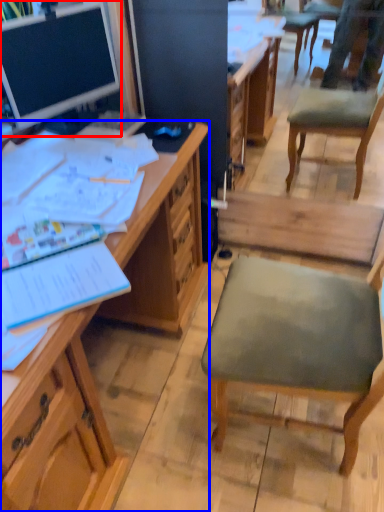
Question: Which of the following is the closest to the observer, desk (highlighted by a red box) or desk (highlighted by a blue box)?

Choices:
 (A) desk
 (B) desk

Answer: (B)